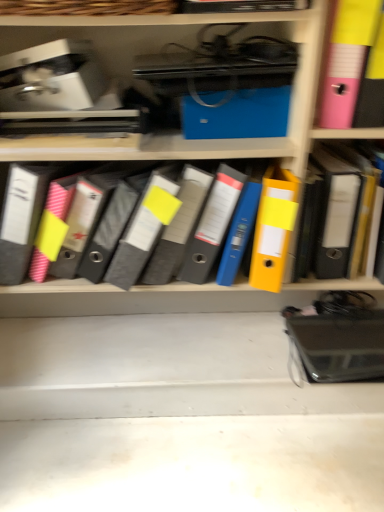
Based on the photo, in order to face pink plastic bin at upper right, should I rotate leftwards or rightwards?

Rotate your view right by about 22.089°.

This screenshot has height=512, width=384. What do you see at coordinates (171, 231) in the screenshot? I see `matte gray binder at center` at bounding box center [171, 231].

Where is `matte gray binder at center`? The height and width of the screenshot is (512, 384). matte gray binder at center is located at coordinates (171, 231).

What do you see at coordinates (236, 114) in the screenshot? I see `blue matte folder at upper center` at bounding box center [236, 114].

Identify the location of pink plastic bin at upper right. The width and height of the screenshot is (384, 512). (347, 60).

Between blue matte folder at upper center and matte gray binder at center, which one appears on the right side from the viewer's perspective?

Positioned to the right is blue matte folder at upper center.

From the image's perspective, is blue matte folder at upper center located above or below matte gray binder at center?

blue matte folder at upper center is situated higher than matte gray binder at center in the image.

Is blue matte folder at upper center surrounding matte gray binder at center?

No, matte gray binder at center is not surrounded by blue matte folder at upper center.

Is matte gray binder at center surrounding pink plastic bin at upper right?

No, pink plastic bin at upper right is not inside matte gray binder at center.

From a real-world perspective, which object stands above the other?

pink plastic bin at upper right.

Is matte gray binder at center facing towards pink plastic bin at upper right?

No, matte gray binder at center does not turn towards pink plastic bin at upper right.

Which of these two, blue matte folder at upper center or pink plastic bin at upper right, stands taller?

Standing taller between the two is pink plastic bin at upper right.

How far apart are blue matte folder at upper center and pink plastic bin at upper right?

A distance of 7.37 inches exists between blue matte folder at upper center and pink plastic bin at upper right.

From a real-world perspective, is blue matte folder at upper center located beneath pink plastic bin at upper right?

Correct, in the physical world, blue matte folder at upper center is lower than pink plastic bin at upper right.

Between blue matte folder at upper center and pink plastic bin at upper right, which one has smaller size?

blue matte folder at upper center is smaller.

Looking at their sizes, would you say matte gray binder at center is wider or thinner than yellow matte folder at right?

Clearly, matte gray binder at center has more width compared to yellow matte folder at right.

Is yellow matte folder at right at the back of matte gray binder at center?

matte gray binder at center does not have its back to yellow matte folder at right.

Is matte gray binder at center inside or outside of yellow matte folder at right?

matte gray binder at center lies outside yellow matte folder at right.

Is yellow matte folder at right positioned with its back to blue matte folder at upper center?

yellow matte folder at right does not have its back to blue matte folder at upper center.

Does point (357, 199) come farther from viewer compared to point (261, 135)?

No, (357, 199) is in front of (261, 135).

Locate an element on the screen. paperback book behind the yellow matte folder at right is located at coordinates click(236, 114).

How different are the orientations of yellow matte folder at right and blue matte folder at upper center in degrees?

The angular difference between yellow matte folder at right and blue matte folder at upper center is 2.03 degrees.

Is yellow matte folder at right wider or thinner than pink plastic bin at upper right?

Clearly, yellow matte folder at right has less width compared to pink plastic bin at upper right.

Considering the relative sizes of yellow matte folder at right and pink plastic bin at upper right in the image provided, is yellow matte folder at right taller than pink plastic bin at upper right?

Indeed, yellow matte folder at right has a greater height compared to pink plastic bin at upper right.

From a real-world perspective, is yellow matte folder at right on pink plastic bin at upper right?

No, from a real-world perspective, yellow matte folder at right is not on top of pink plastic bin at upper right.

Is matte gray binder at center smaller than blue matte folder at upper center?

No, matte gray binder at center is not smaller than blue matte folder at upper center.

Is matte gray binder at center touching blue matte folder at upper center?

No, matte gray binder at center is not next to blue matte folder at upper center.

From the image's perspective, is matte gray binder at center above blue matte folder at upper center?

No, from the image's perspective, matte gray binder at center is not above blue matte folder at upper center.

Can you confirm if matte gray binder at center is shorter than blue matte folder at upper center?

No.

Where is `paperback book that is on the right side of matte gray binder at center`? The image size is (384, 512). paperback book that is on the right side of matte gray binder at center is located at coordinates (236, 114).

Find the location of a particular element. This screenshot has width=384, height=512. bin above the matte gray binder at center (from the image's perspective) is located at coordinates (347, 60).

Based on their spatial positions, is yellow matte folder at right or pink plastic bin at upper right closer to matte gray binder at center?

yellow matte folder at right is closer to matte gray binder at center.

From the picture: Considering their positions, is blue matte folder at upper center positioned further to matte gray binder at center than pink plastic bin at upper right?

pink plastic bin at upper right lies further to matte gray binder at center than the other object.

Considering their positions, is yellow matte folder at right positioned closer to pink plastic bin at upper right than matte gray binder at center?

Based on the image, yellow matte folder at right appears to be nearer to pink plastic bin at upper right.

Which object lies further to the anchor point pink plastic bin at upper right, yellow matte folder at right or blue matte folder at upper center?

Based on the image, yellow matte folder at right appears to be further to pink plastic bin at upper right.

Looking at the image, which one is located further to blue matte folder at upper center, matte gray binder at center or yellow matte folder at right?

Based on the image, yellow matte folder at right appears to be further to blue matte folder at upper center.

Estimate the real-world distances between objects in this image. Which object is closer to yellow matte folder at right, matte gray binder at center or pink plastic bin at upper right?

The object closer to yellow matte folder at right is pink plastic bin at upper right.

Looking at the image, which one is located further to pink plastic bin at upper right, matte gray binder at center or blue matte folder at upper center?

The object further to pink plastic bin at upper right is matte gray binder at center.

Estimate the real-world distances between objects in this image. Which object is further from blue matte folder at upper center, yellow matte folder at right or matte gray binder at center?

The object further to blue matte folder at upper center is yellow matte folder at right.

Locate an element on the screen. This screenshot has width=384, height=512. paperback book between matte gray binder at center and pink plastic bin at upper right in the horizontal direction is located at coordinates (236, 114).

Where is `paperback book located between matte gray binder at center and yellow matte folder at right in the left-right direction`? The width and height of the screenshot is (384, 512). paperback book located between matte gray binder at center and yellow matte folder at right in the left-right direction is located at coordinates (236, 114).

What are the coordinates of `bin located between matte gray binder at center and yellow matte folder at right in the left-right direction` in the screenshot? It's located at (347, 60).

Locate an element on the screen. This screenshot has height=512, width=384. bin between blue matte folder at upper center and yellow matte folder at right is located at coordinates (347, 60).